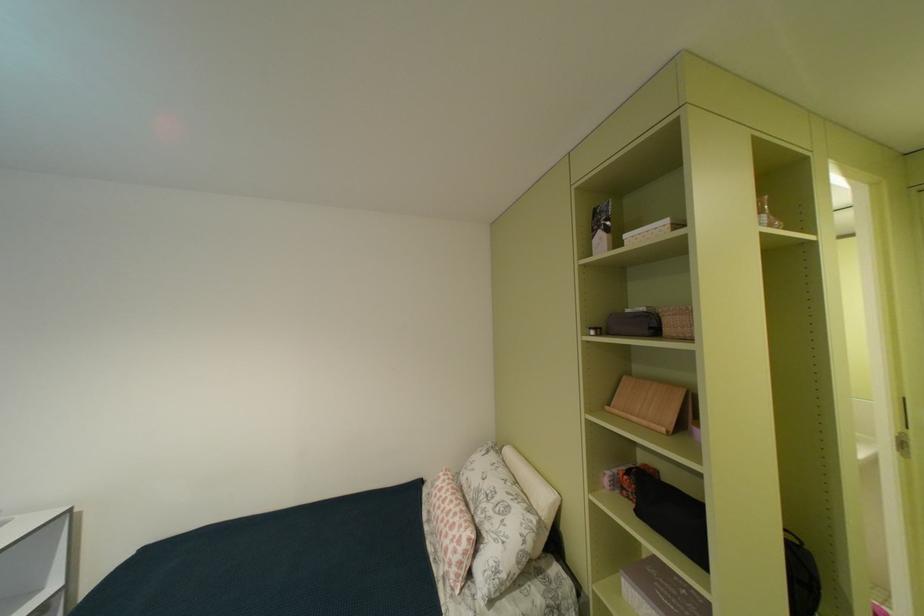
The location [497,522] corresponds to which object?

It corresponds to the white floral pillow in the image.